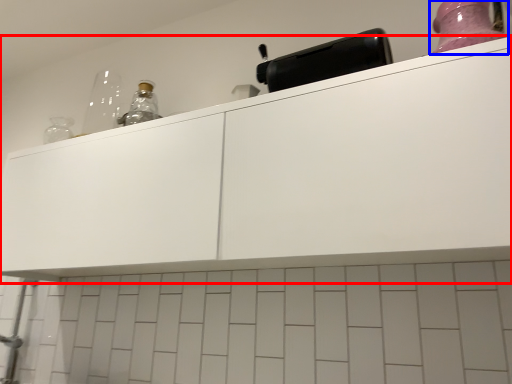
Question: Which object appears farthest to the camera in this image, cabinetry (highlighted by a red box) or bottle (highlighted by a blue box)?

Choices:
 (A) cabinetry
 (B) bottle

Answer: (B)